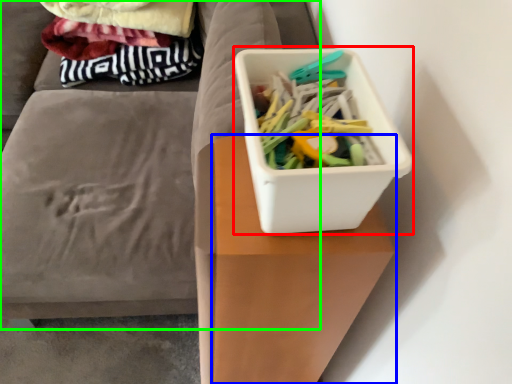
Question: Which object is the farthest from storage box (highlighted by a red box)? Choose among these: table (highlighted by a blue box) or furniture (highlighted by a green box).

Choices:
 (A) table
 (B) furniture

Answer: (B)